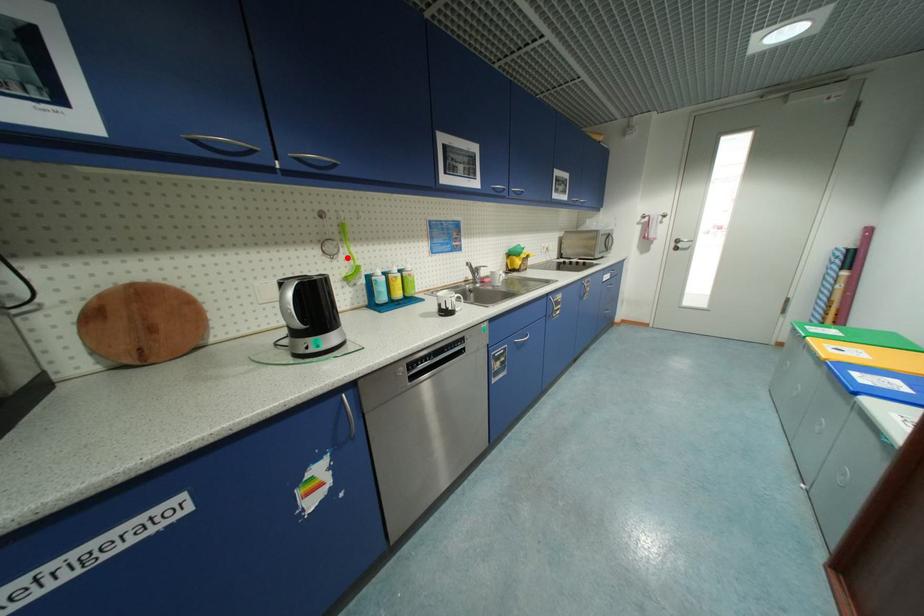
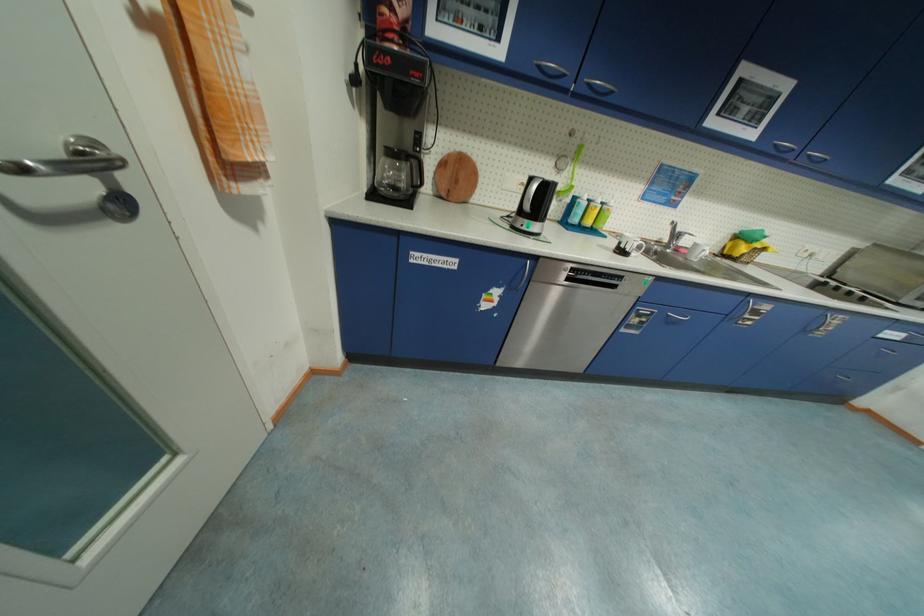
Locate, in the second image, the point that corresponds to the highlighted location in the first image.

(570, 175)